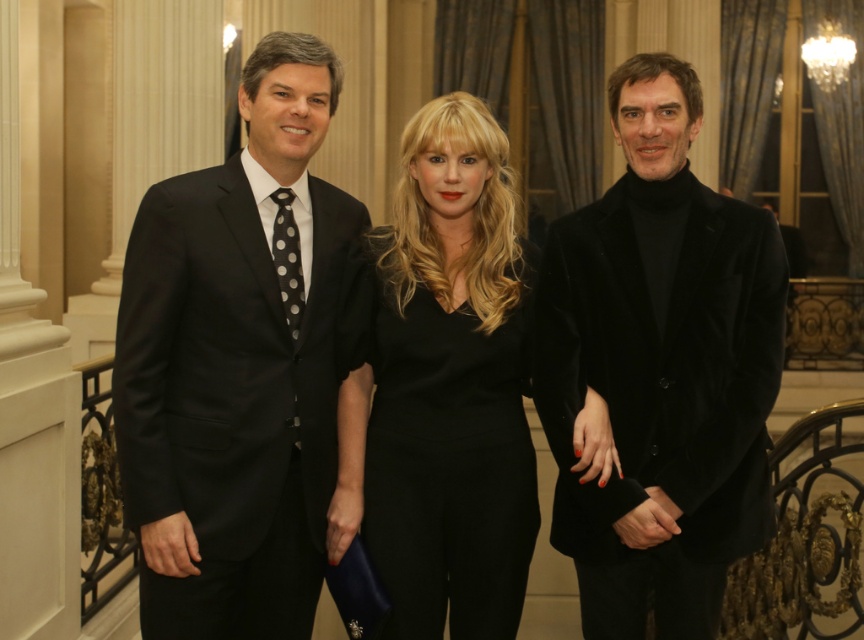
Can you confirm if matte black suit at left is positioned to the left of velvet black jacket at right?

Yes, matte black suit at left is to the left of velvet black jacket at right.

Between point (264, 396) and point (770, 355), which one is positioned behind?

The point (264, 396) is more distant.

You are a GUI agent. You are given a task and a screenshot of the screen. Output one action in this format:
    pyautogui.click(x=<x>, y=<y>)
    Task: Click on the matte black suit at left
    This screenshot has height=640, width=864.
    Given the screenshot: What is the action you would take?
    pyautogui.click(x=238, y=364)

Consider the image. Is matte black suit at left positioned behind black velvet dress at center?

No.

Is point (119, 419) positioned after point (417, 580)?

No.

Find the location of a particular element. matte black suit at left is located at coordinates (238, 364).

Is velvet black jacket at right to the left of black velvet dress at center from the viewer's perspective?

No, velvet black jacket at right is not to the left of black velvet dress at center.

Locate an element on the screen. velvet black jacket at right is located at coordinates (661, 369).